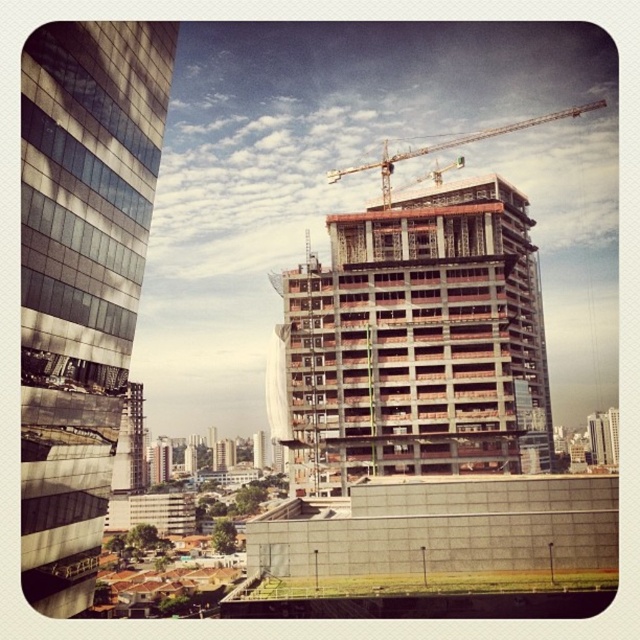
Question: Can you confirm if reflective glass building at left is positioned to the right of metallic construction crane at upper center?

Choices:
 (A) yes
 (B) no

Answer: (B)

Question: Estimate the real-world distances between objects in this image. Which object is farther from the concrete building at center?

Choices:
 (A) reflective glass building at left
 (B) concrete tower at center
 (C) metallic construction crane at upper center

Answer: (B)

Question: Can you confirm if concrete building at center is bigger than concrete tower at center?

Choices:
 (A) no
 (B) yes

Answer: (B)

Question: Which of the following is the closest to the observer?

Choices:
 (A) metallic construction crane at upper center
 (B) concrete tower at center

Answer: (B)

Question: In this image, where is concrete building at center located relative to metallic construction crane at upper center?

Choices:
 (A) right
 (B) left

Answer: (B)

Question: Which point appears farthest from the camera in this image?

Choices:
 (A) (346, 173)
 (B) (115, 76)
 (C) (339, 429)
 (D) (125, 403)

Answer: (D)